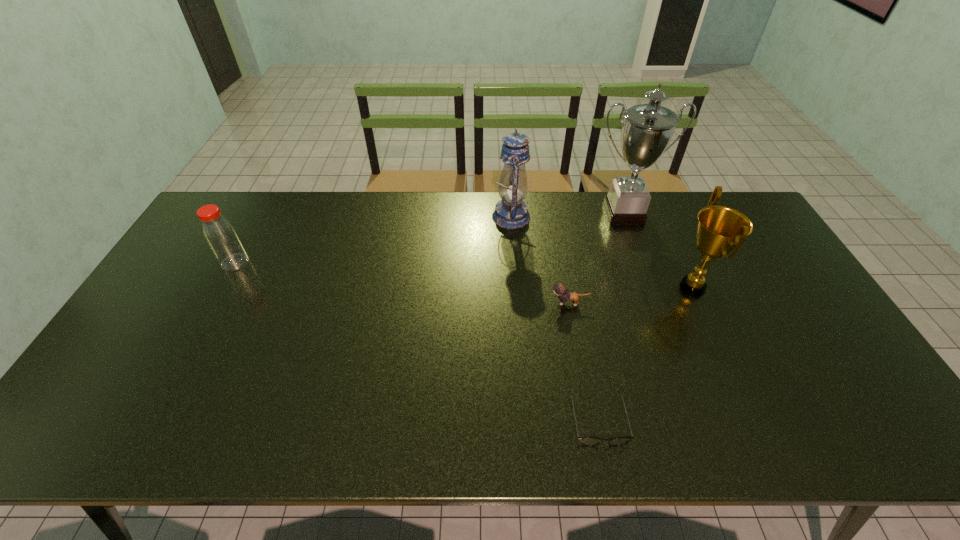
Find the location of a particular element. trophy cup is located at coordinates (647, 129).

This screenshot has width=960, height=540. I want to click on lantern, so click(x=511, y=212).

Find the location of `award`. award is located at coordinates (720, 229).

Find the location of `bottle`. bottle is located at coordinates (219, 233).

You are a GUI agent. You are given a task and a screenshot of the screen. Output one action in this format:
    pyautogui.click(x=<x>, y=<y>)
    Task: Click on the leftmost object
    This screenshot has height=540, width=960.
    Given the screenshot: What is the action you would take?
    pyautogui.click(x=219, y=233)

This screenshot has height=540, width=960. Identify the location of kitten. (560, 290).

Identify the location of spectacles. (588, 441).

In order to click on the nearest object in this screenshot , I will do `click(588, 441)`.

Where is `vacant space situated 0.070m at the front view of the tallest object`? The height and width of the screenshot is (540, 960). vacant space situated 0.070m at the front view of the tallest object is located at coordinates (634, 241).

You are a GUI agent. You are given a task and a screenshot of the screen. Output one action in this format:
    pyautogui.click(x=<x>, y=<y>)
    Task: Click on the vacant space located on the front-facing side of the lantern
    Image resolution: width=960 pixels, height=540 pixels.
    Given the screenshot: What is the action you would take?
    pyautogui.click(x=397, y=217)